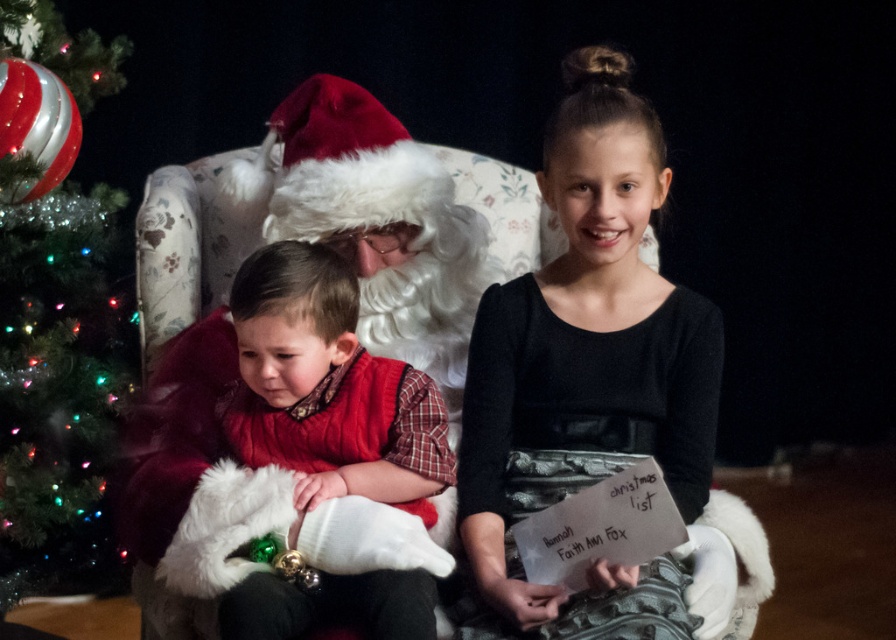
You are standing in the festive scene and want to place a small gift exactly halfway between point (x=270, y=636) and point (x=82, y=232). According to the scene description, will the gift be closer to Santa Claus or the young girl holding the sign?

The gift placed halfway between point (x=270, y=636) and point (x=82, y=232) will be closer to Santa Claus because point (x=270, y=636) is in front of point (x=82, y=232), meaning the midpoint is nearer to the first point.

You are a photographer adjusting your camera focus. You need to focus on both the point at (586,204) and the point at (613,484). Which point should you focus on first to ensure both are in focus?

You should focus on point (586,204) first because it is closer to the camera than point (613,484). By focusing on the closer point, the further point will also be in focus due to the depth of field.